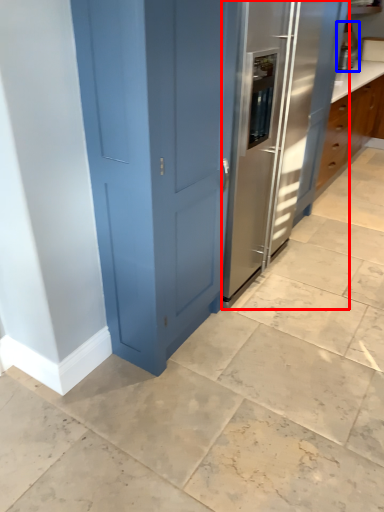
Question: Which object appears closest to the camera in this image, fridge (highlighted by a red box) or appliance (highlighted by a blue box)?

Choices:
 (A) fridge
 (B) appliance

Answer: (A)